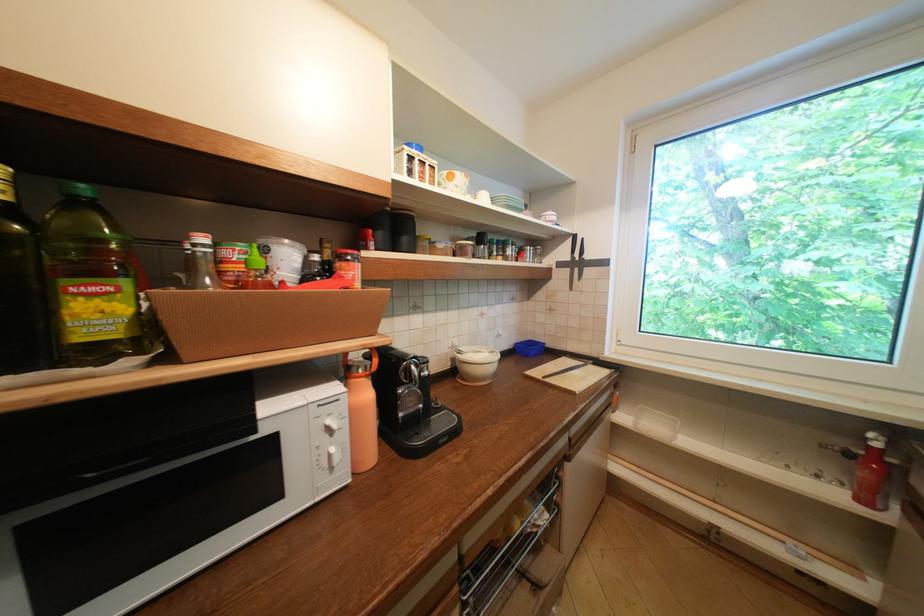
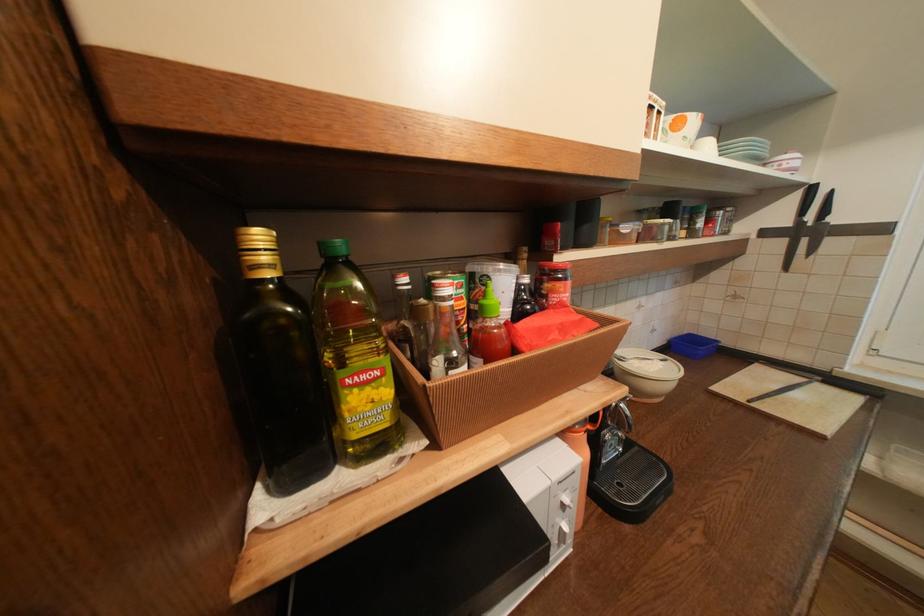
Find the pixel in the second image that matches the point at 497,355 in the first image.

(670, 363)